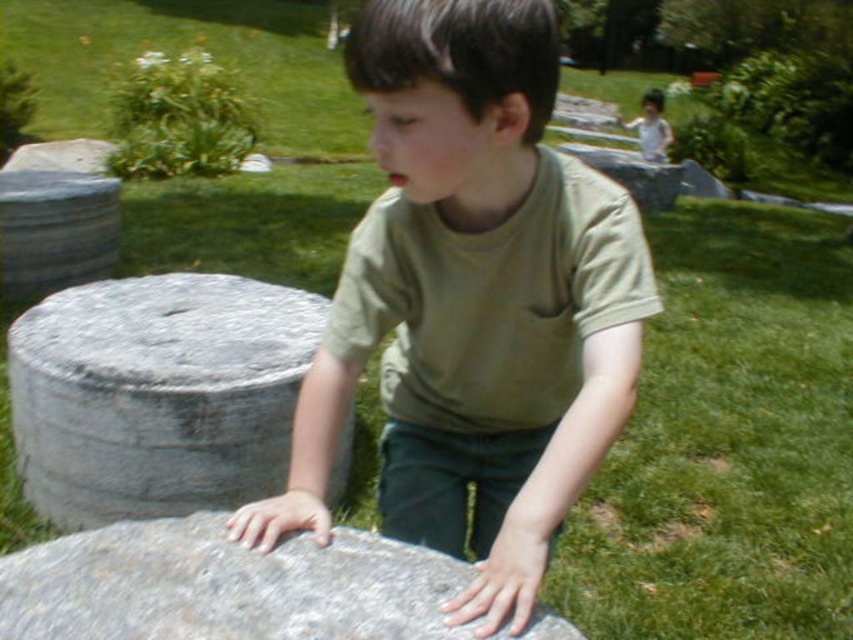
In the park scene, there are two gray stones mentioned. The first is labeled as gray rough stone at left, and the second is gray stone at left. Based on their positions, which one is closer to the ground?

The gray rough stone at left is positioned under gray stone at left, so the gray rough stone at left is closer to the ground.

Based on the photo, you are standing in the park and see the gray rough stone at left. If you want to reach it without moving your feet, can you just stretch your arm out?

The gray rough stone at left is 6.89 feet away from you. Since the average human arm length is about 2.5 feet, you cannot reach it without moving closer.

You are a parent trying to locate your child in the park. Your child is wearing a green matte shirt at center and you are standing near the gray stone at left. How far apart are you and your child?

The distance between the green matte shirt at center and the gray stone at left is 4.01 meters.